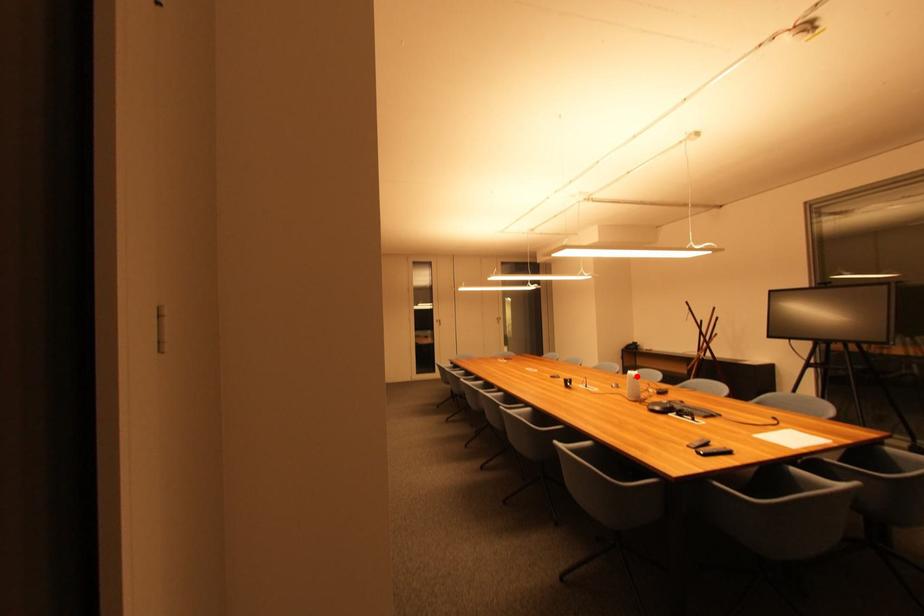
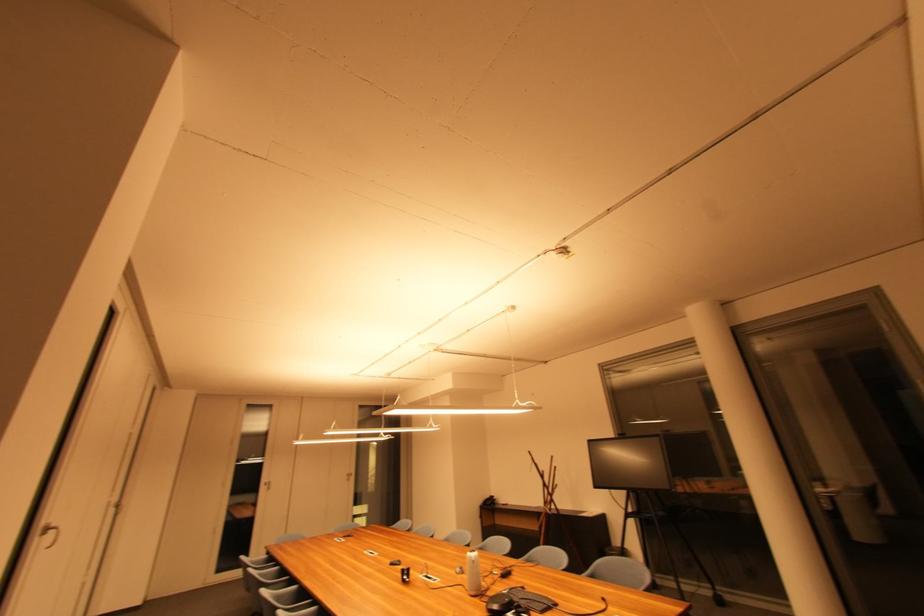
Question: I am providing you with two images of the same scene from different viewpoints. A red point is marked on the first image. At the location where the point appears in image 1, is it still visible in image 2?

Choices:
 (A) Yes
 (B) No

Answer: (A)